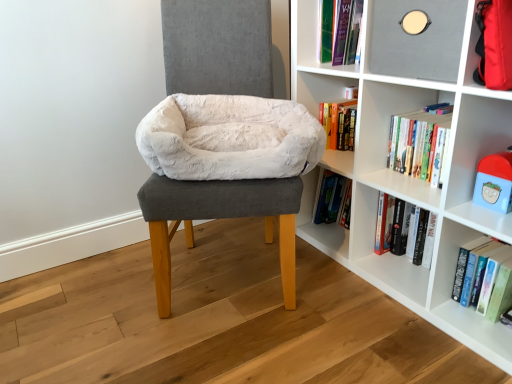
At what (x,y) coordinates should I click in order to perform the action: click on unoccupied area in front of white plush pet bed at center. Please return your answer as a coordinate pair (x, y). Looking at the image, I should click on point(238,352).